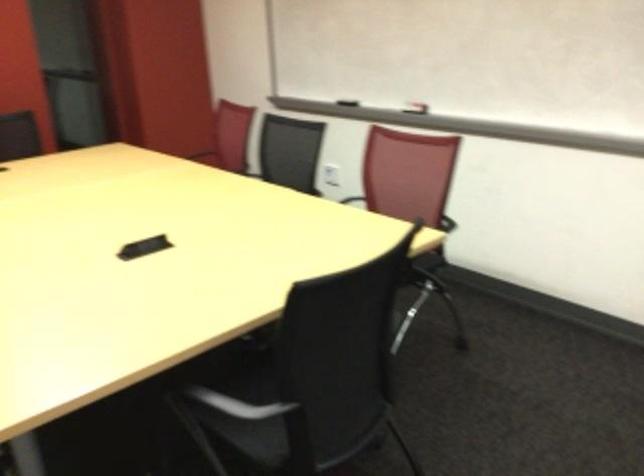
Question: The camera is either moving clockwise (left) or counter-clockwise (right) around the object. The first image is from the beginning of the video and the second image is from the end. Is the camera moving left or right when shooting the video?

Choices:
 (A) Left
 (B) Right

Answer: (B)